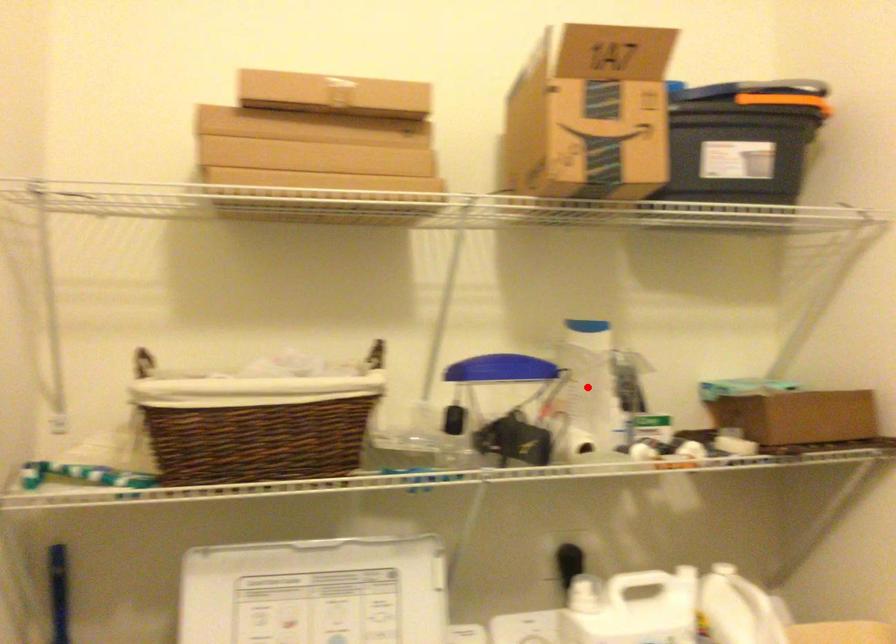
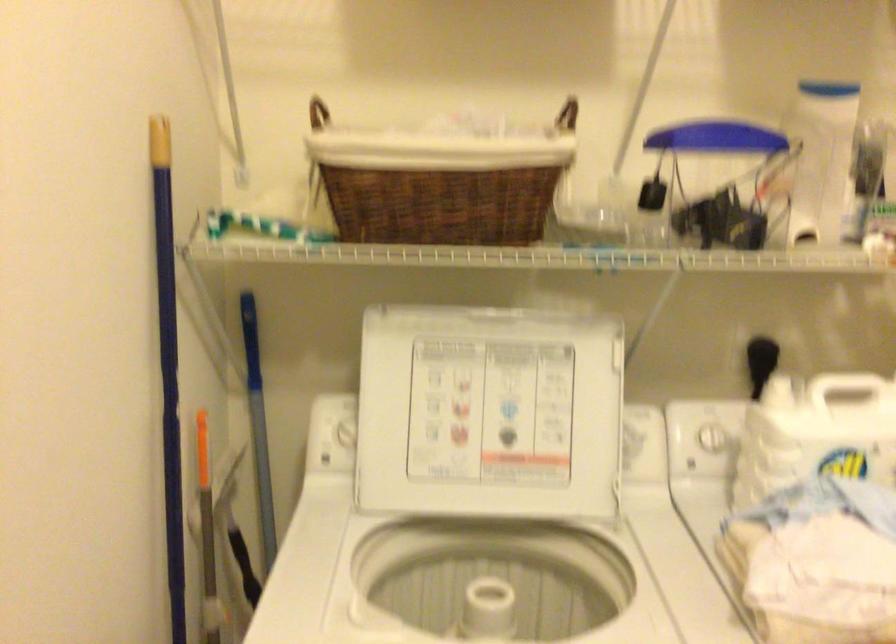
The point at the highlighted location is marked in the first image. Where is the corresponding point in the second image?

(821, 158)